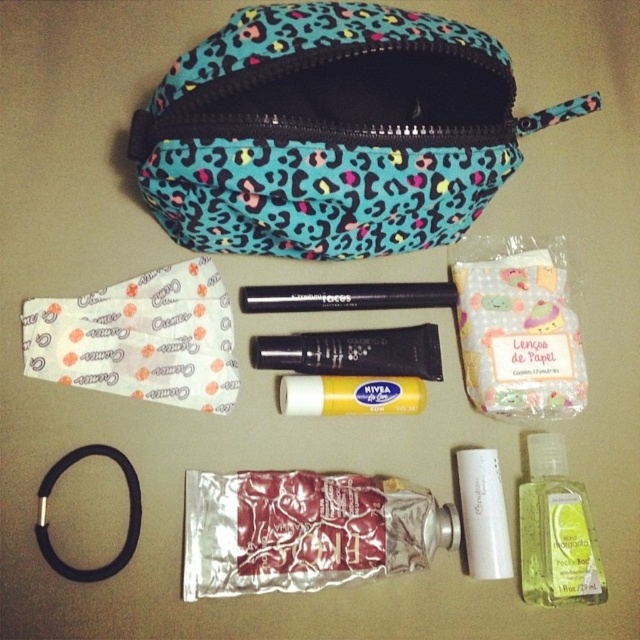
You are a makeup artist who needs to place a 4.5 inch wide palette between the black matte tube at center and the white matte tube at center. Can you fit it there?

The black matte tube at center and the white matte tube at center are 9.06 inches apart. Since the palette is 4.5 inches wide, there is enough space to fit it between them as the distance between the tubes is greater than the palette width.

You are organizing a makeup kit and need to place the blue leopard print pouch at upper center. Where should you position it relative to the other items on the beige surface?

The blue leopard print pouch at upper center should be placed at the coordinates point (332, 132) to ensure proper positioning relative to the other items on the beige surface.